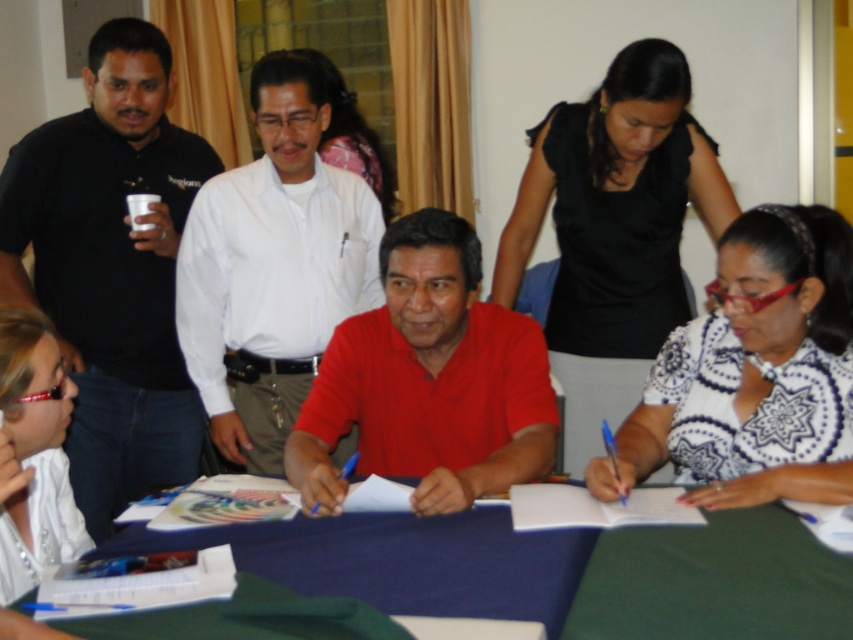
You are organizing a charity event and need to decide which of the two shirts, the matte red polo shirt at center or the white glossy shirt at lower left, would be more visible to attendees from a distance. Based on their sizes, which one would you choose?

The matte red polo shirt at center is bigger than the white glossy shirt at lower left, so it would be more visible from a distance due to its larger size.

You are standing at the entrance of the room and see the black shirt at left and the red polo shirt at the table. Which person is closer to the entrance?

The black shirt at left is closer to the entrance because it is located at point (x=111, y=266), which is closer to the entrance than the red polo shirt at the table.